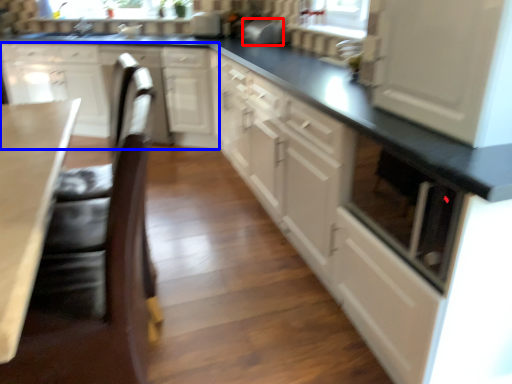
Question: Among these objects, which one is nearest to the camera, appliance (highlighted by a red box) or cabinetry (highlighted by a blue box)?

Choices:
 (A) appliance
 (B) cabinetry

Answer: (B)